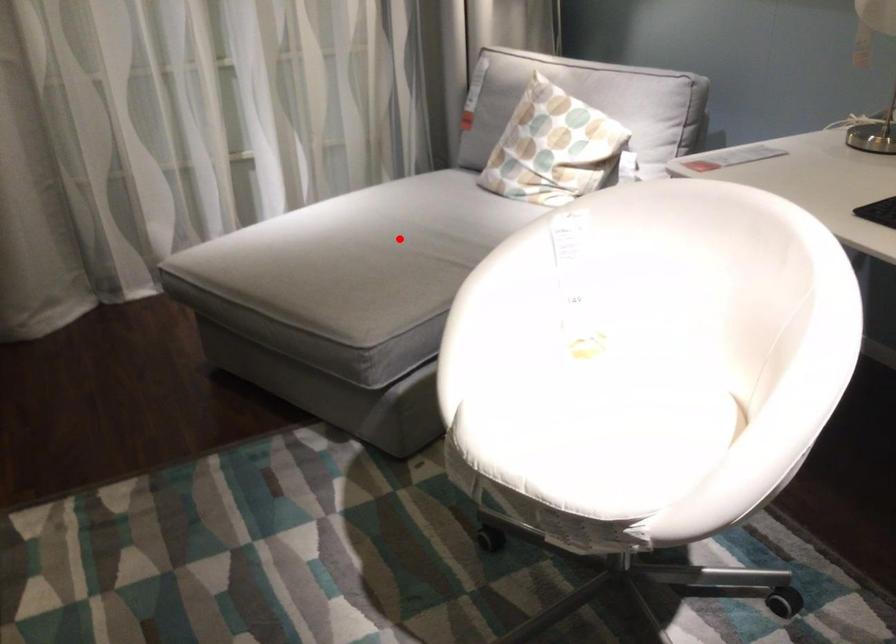
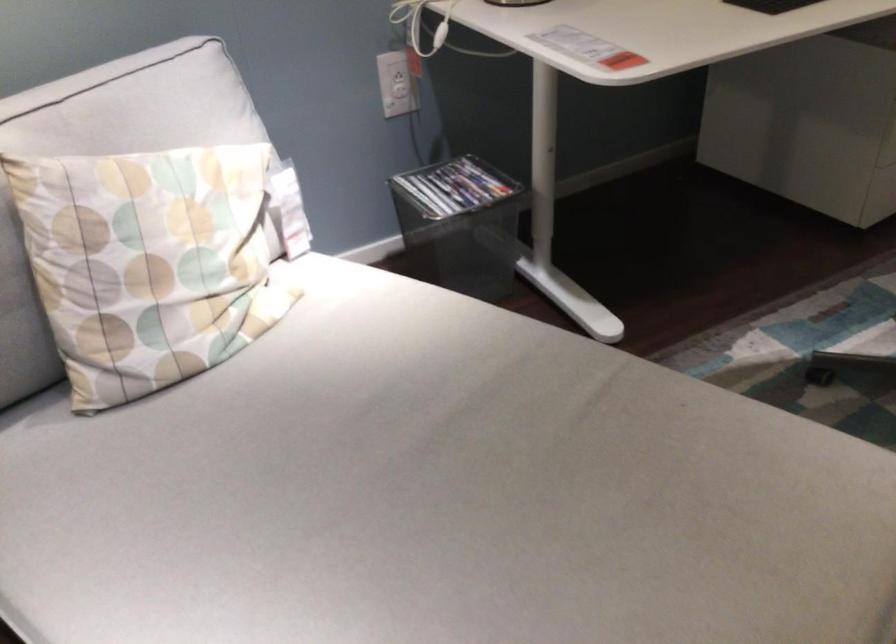
Question: A red point is marked in image1. In image2, is the corresponding 3D point closer to the camera or farther? Reply with the corresponding letter.

Choices:
 (A) The corresponding 3D point is closer.
 (B) The corresponding 3D point is farther.

Answer: (A)